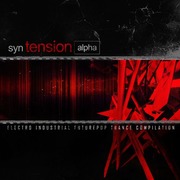
Find the location of `black marbling with white veining`. black marbling with white veining is located at coordinates (132, 22).